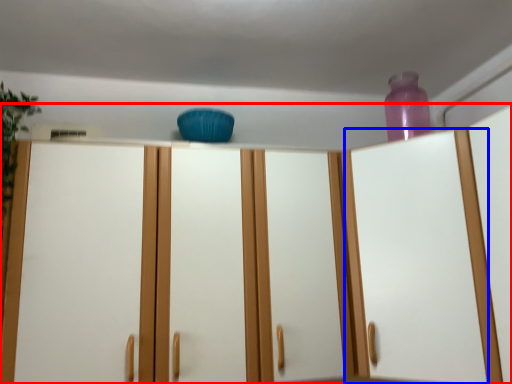
Question: Which point is closer to the camera, cupboard (highlighted by a red box) or glass door (highlighted by a blue box)?

Choices:
 (A) cupboard
 (B) glass door

Answer: (A)